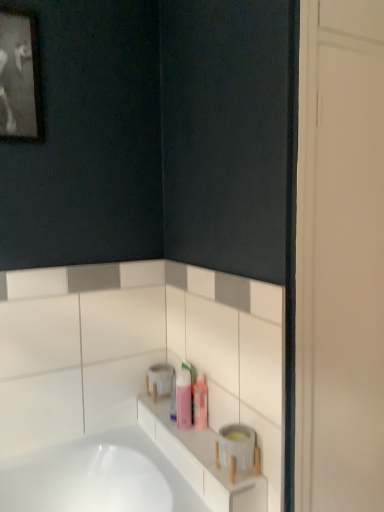
Question: From a real-world perspective, does white matte toilet paper at upper center stand above black matte picture frame at upper left?

Choices:
 (A) yes
 (B) no

Answer: (B)

Question: Considering the relative positions of white matte toilet paper at upper center and black matte picture frame at upper left in the image provided, is white matte toilet paper at upper center behind black matte picture frame at upper left?

Choices:
 (A) yes
 (B) no

Answer: (A)

Question: From the image's perspective, is white matte toilet paper at upper center beneath black matte picture frame at upper left?

Choices:
 (A) no
 (B) yes

Answer: (B)

Question: Can we say white matte toilet paper at upper center lies outside black matte picture frame at upper left?

Choices:
 (A) yes
 (B) no

Answer: (A)

Question: Does white matte toilet paper at upper center appear on the right side of black matte picture frame at upper left?

Choices:
 (A) yes
 (B) no

Answer: (A)

Question: Is white matte toilet paper at upper center looking in the opposite direction of black matte picture frame at upper left?

Choices:
 (A) no
 (B) yes

Answer: (A)

Question: Does translucent plastic containers at lower center have a smaller size compared to pink plastic bottle at center?

Choices:
 (A) yes
 (B) no

Answer: (B)

Question: Would you say pink plastic bottle at center is part of translucent plastic containers at lower center's contents?

Choices:
 (A) yes
 (B) no

Answer: (B)

Question: Does translucent plastic containers at lower center have a lesser height compared to pink plastic bottle at center?

Choices:
 (A) no
 (B) yes

Answer: (B)

Question: Is the depth of translucent plastic containers at lower center less than that of pink plastic bottle at center?

Choices:
 (A) yes
 (B) no

Answer: (A)

Question: Can you confirm if translucent plastic containers at lower center is positioned to the left of pink plastic bottle at center?

Choices:
 (A) no
 (B) yes

Answer: (A)

Question: Can you confirm if translucent plastic containers at lower center is thinner than pink plastic bottle at center?

Choices:
 (A) yes
 (B) no

Answer: (B)

Question: From the image's perspective, is black matte picture frame at upper left located beneath pink plastic bottle at center?

Choices:
 (A) no
 (B) yes

Answer: (A)